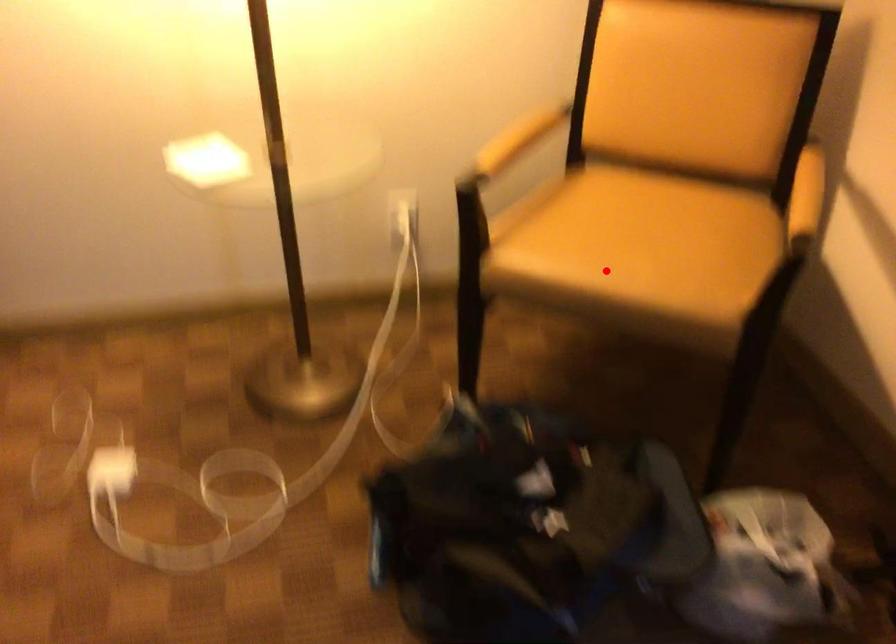
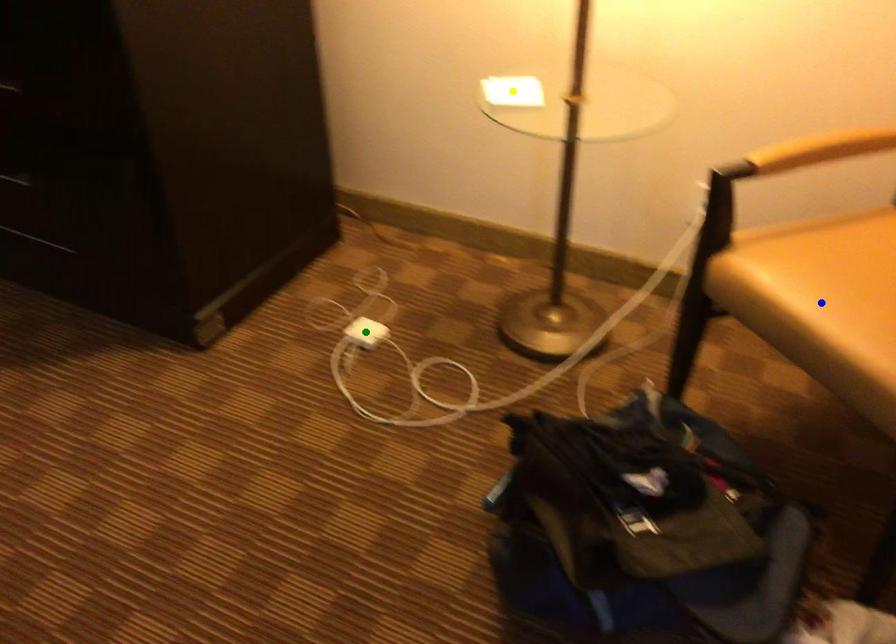
Question: I am providing you with two images of the same scene from different viewpoints. A red point is marked on the first image. You are given multiple points on the second image. Which point in image 2 is actually the same real-world point as the red point in image 1?

Choices:
 (A) blue point
 (B) green point
 (C) yellow point

Answer: (A)